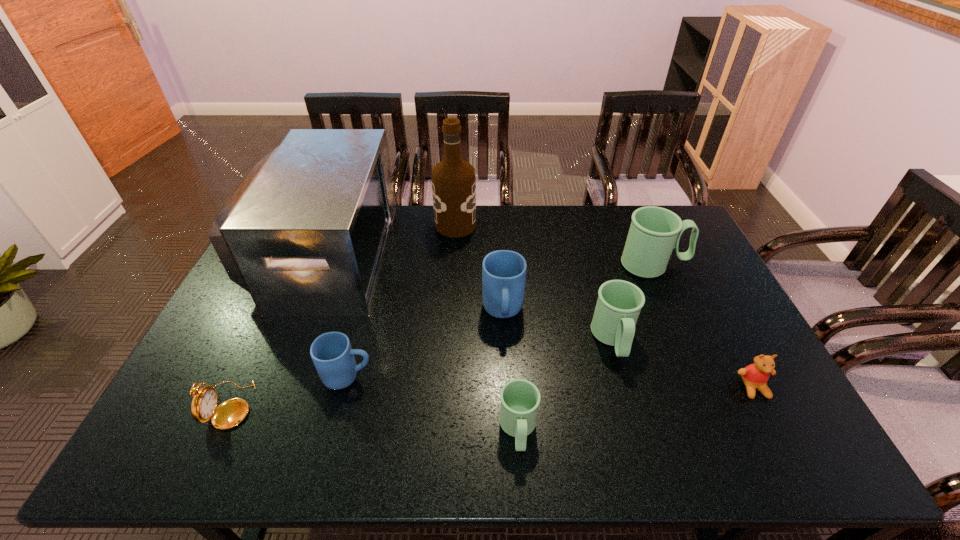
Locate an element on the screen. vacant space situated on the side of the second farthest green mug with the handle is located at coordinates (634, 412).

Image resolution: width=960 pixels, height=540 pixels. I want to click on free spot located on the side of the left blue mug with the handle, so click(423, 376).

Image resolution: width=960 pixels, height=540 pixels. Identify the location of vacant region located 0.400m on the face of the pocket watch. (412, 405).

Where is `vacant point located 0.140m on the front-facing side of the teddy bear`? This screenshot has width=960, height=540. vacant point located 0.140m on the front-facing side of the teddy bear is located at coordinates (788, 455).

This screenshot has width=960, height=540. Find the location of `alcohol that is at the far edge`. alcohol that is at the far edge is located at coordinates (453, 180).

Locate an element on the screen. The image size is (960, 540). microwave oven located at the far edge is located at coordinates (305, 234).

Locate an element on the screen. The width and height of the screenshot is (960, 540). pocket watch that is at the near edge is located at coordinates (230, 413).

I want to click on mug located at the near edge, so click(x=520, y=398).

The height and width of the screenshot is (540, 960). In order to click on microwave oven that is at the left edge in this screenshot , I will do `click(305, 234)`.

Locate an element on the screen. This screenshot has width=960, height=540. pocket watch situated at the left edge is located at coordinates (230, 413).